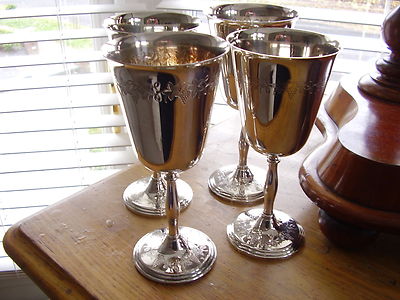
Identify the location of bases of silver cups. (185, 260), (185, 191), (245, 223), (238, 189).